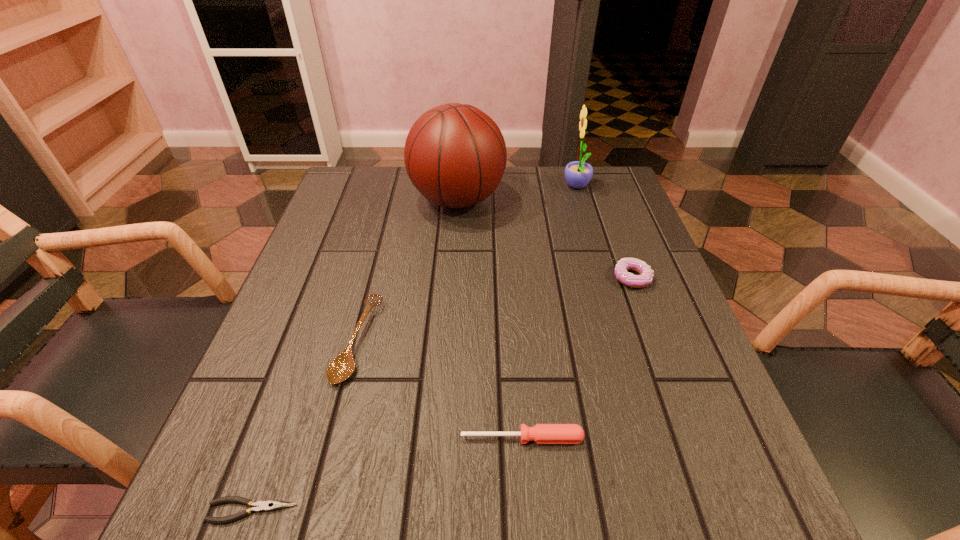
Identify the location of vacant space located on the front-facing side of the sunflower. (523, 187).

Locate an element on the screen. This screenshot has height=540, width=960. free point located on the front-facing side of the sunflower is located at coordinates (450, 187).

Where is `vacant region located 0.380m on the left of the fourth nearest object`? This screenshot has height=540, width=960. vacant region located 0.380m on the left of the fourth nearest object is located at coordinates point(435,278).

Locate an element on the screen. The image size is (960, 540). free space located 0.200m on the back of the fourth farthest object is located at coordinates (383, 239).

Where is `vacant space situated on the right of the screwdriver`? Image resolution: width=960 pixels, height=540 pixels. vacant space situated on the right of the screwdriver is located at coordinates (648, 438).

Locate an element on the screen. The image size is (960, 540). free point located 0.250m on the back of the pliers is located at coordinates pos(308,353).

The height and width of the screenshot is (540, 960). I want to click on basketball that is at the far edge, so click(455, 155).

Image resolution: width=960 pixels, height=540 pixels. Find the location of `sunflower positioned at the far edge`. sunflower positioned at the far edge is located at coordinates (578, 174).

Locate an element on the screen. The height and width of the screenshot is (540, 960). object located at the near edge is located at coordinates (270, 505).

Find the location of a particular element. ladle at the left edge is located at coordinates (340, 368).